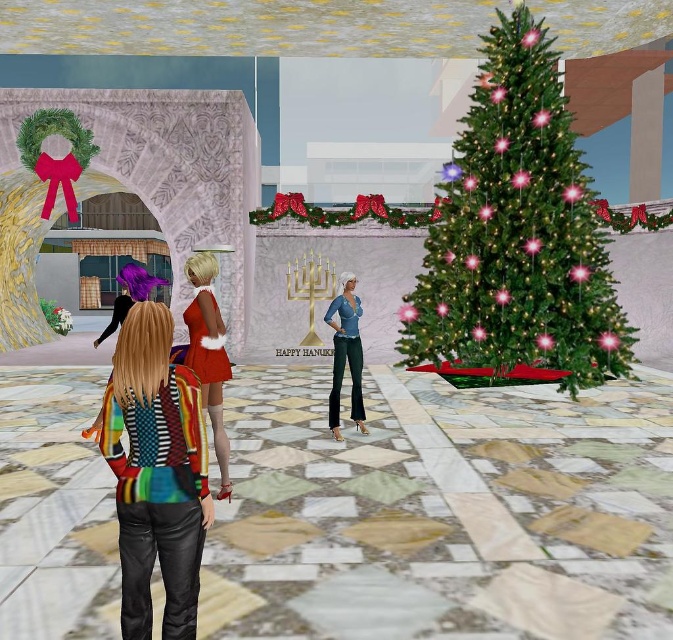
Question: Can you confirm if green matte christmas tree at right is smaller than shiny red dress at center?

Choices:
 (A) no
 (B) yes

Answer: (B)

Question: Among these points, which one is nearest to the camera?

Choices:
 (A) (518, 150)
 (B) (217, 339)

Answer: (B)

Question: Which of these objects is positioned closest to the shiny red dress at center?

Choices:
 (A) multicolored striped sweater at center
 (B) denim jeans at center

Answer: (B)

Question: Does green matte christmas tree at right have a smaller size compared to multicolored striped sweater at center?

Choices:
 (A) no
 (B) yes

Answer: (B)

Question: Is green matte christmas tree at right bigger than multicolored striped sweater at center?

Choices:
 (A) no
 (B) yes

Answer: (A)

Question: Which object is closer to the camera taking this photo?

Choices:
 (A) denim jeans at center
 (B) multicolored striped sweater at center
 (C) shiny red dress at center
 (D) green matte christmas tree at right

Answer: (B)